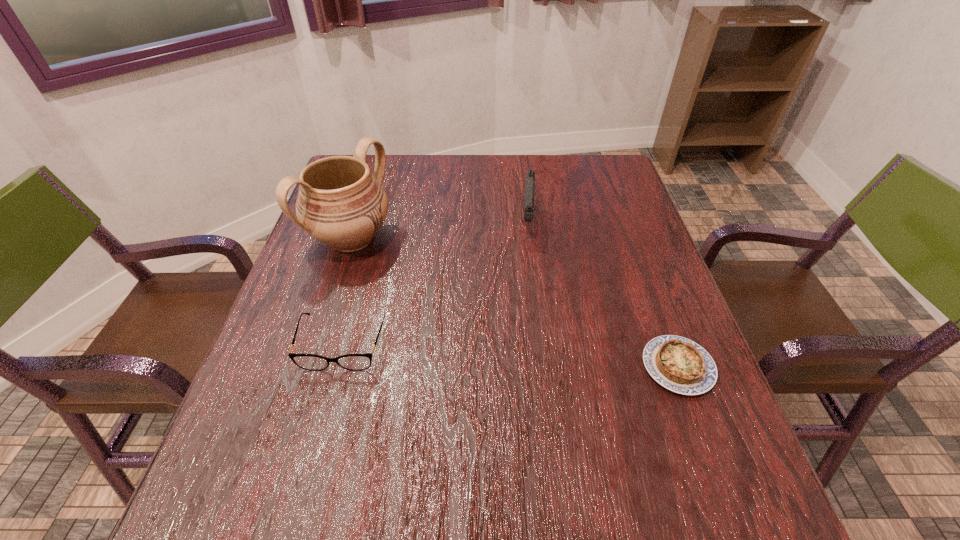
Identify the location of free space at the right edge of the desktop. This screenshot has height=540, width=960. (617, 204).

Find the location of `vacant area at the far left corner`. vacant area at the far left corner is located at coordinates (385, 188).

Identify the location of vacant space at the near left corner of the desktop. This screenshot has height=540, width=960. (267, 442).

In the image, there is a desktop. Where is `vacant area at the far right corner`? vacant area at the far right corner is located at coordinates (614, 180).

You are a GUI agent. You are given a task and a screenshot of the screen. Output one action in this format:
    pyautogui.click(x=<x>, y=<y>)
    Task: Click on the free spot between the pistol and the tallest object
    Image resolution: width=960 pixels, height=540 pixels.
    Given the screenshot: What is the action you would take?
    pyautogui.click(x=440, y=231)

Find the location of a particular element. vacant region between the pistol and the rightmost object is located at coordinates (603, 294).

At what (x,y) coordinates should I click in order to perform the action: click on vacant point located between the urn and the quiche. Please return your answer as a coordinate pair (x, y). Looking at the image, I should click on (515, 303).

This screenshot has height=540, width=960. What are the coordinates of `vacant area that lies between the urn and the pistol` in the screenshot? It's located at (440, 231).

Where is `free spot between the urn and the pistol`? free spot between the urn and the pistol is located at coordinates pyautogui.click(x=440, y=231).

Where is `free spot between the shortest object and the tallest object`? free spot between the shortest object and the tallest object is located at coordinates (515, 303).